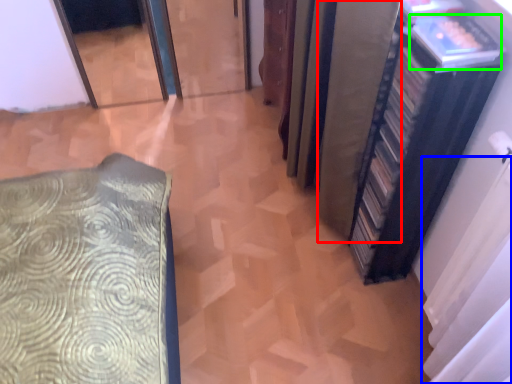
Question: Estimate the real-world distances between objects in this image. Which object is closer to curtain (highlighted by a red box), curtain (highlighted by a blue box) or book (highlighted by a green box)?

Choices:
 (A) curtain
 (B) book

Answer: (B)